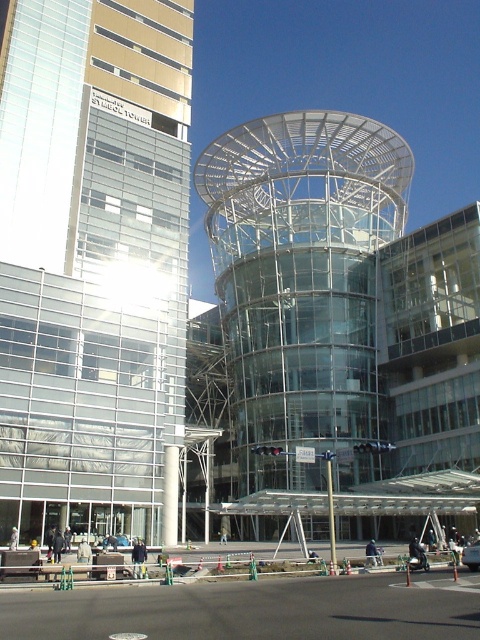
Is glassy reflective tower at left to the right of transparent glass tower at center from the viewer's perspective?

Incorrect, glassy reflective tower at left is not on the right side of transparent glass tower at center.

Identify the location of glassy reflective tower at left. (93, 262).